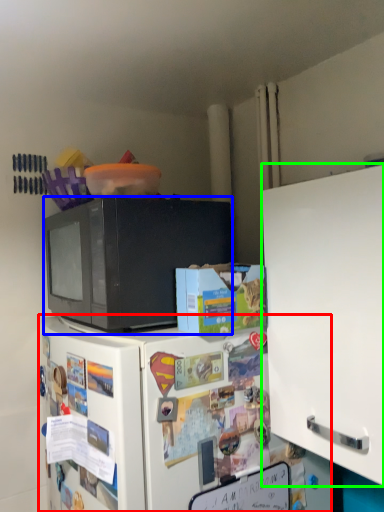
Question: Which object is positioned closest to refrigerator (highlighted by a red box)? Select from microwave oven (highlighted by a blue box) and cabinetry (highlighted by a green box).

Choices:
 (A) microwave oven
 (B) cabinetry

Answer: (A)